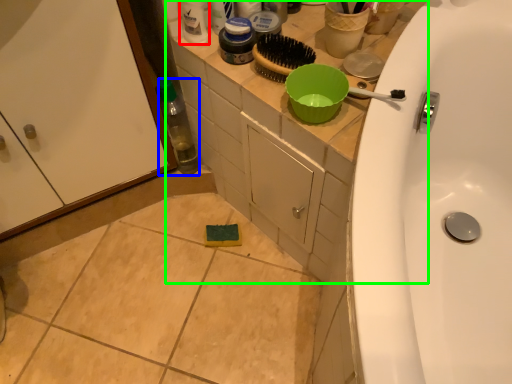
Question: Estimate the real-world distances between objects in this image. Which object is farther from cleaning product (highlighted by a red box), bottle (highlighted by a blue box) or counter top (highlighted by a green box)?

Choices:
 (A) bottle
 (B) counter top

Answer: (A)